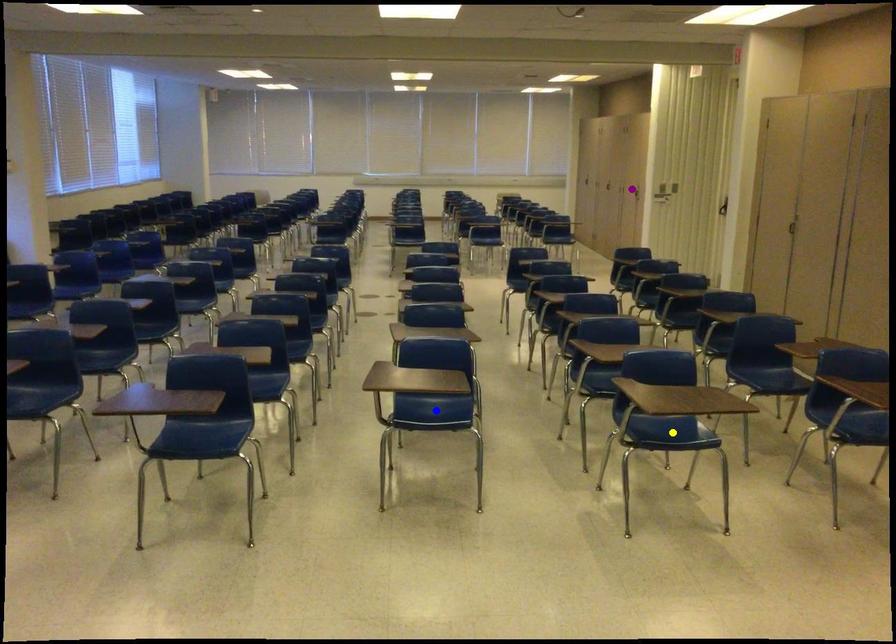
Order these from nearest to farthest:
yellow point, purple point, blue point

purple point → blue point → yellow point